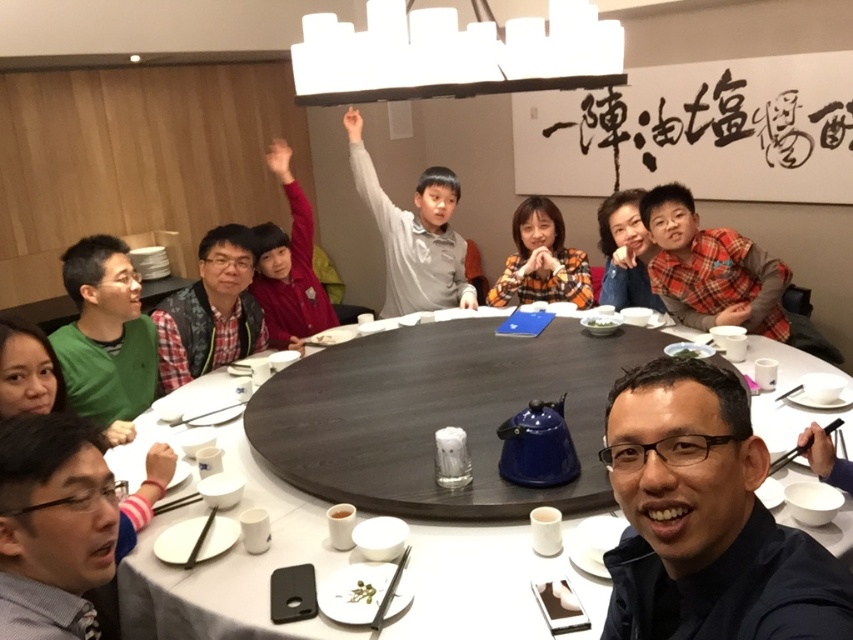
Question: Is black matte shirt at lower right thinner than matte black hair at center?

Choices:
 (A) no
 (B) yes

Answer: (B)

Question: Estimate the real-world distances between objects in this image. Which object is closer to the green matte shirt at lower left?

Choices:
 (A) white porcelain bowl at center
 (B) orange plaid shirt at center

Answer: (A)

Question: Is gray sweater at center behind orange plaid shirt at center?

Choices:
 (A) no
 (B) yes

Answer: (A)

Question: Which point is closer to the camera taking this photo?

Choices:
 (A) (659, 589)
 (B) (715, 317)

Answer: (A)

Question: Can you confirm if black matte shirt at lower right is positioned below gray fabric shirt at lower left?

Choices:
 (A) yes
 (B) no

Answer: (B)

Question: Considering the real-world distances, which object is closest to the matte black hair at center?

Choices:
 (A) white porcelain bowl at center
 (B) dark wood table at center

Answer: (A)